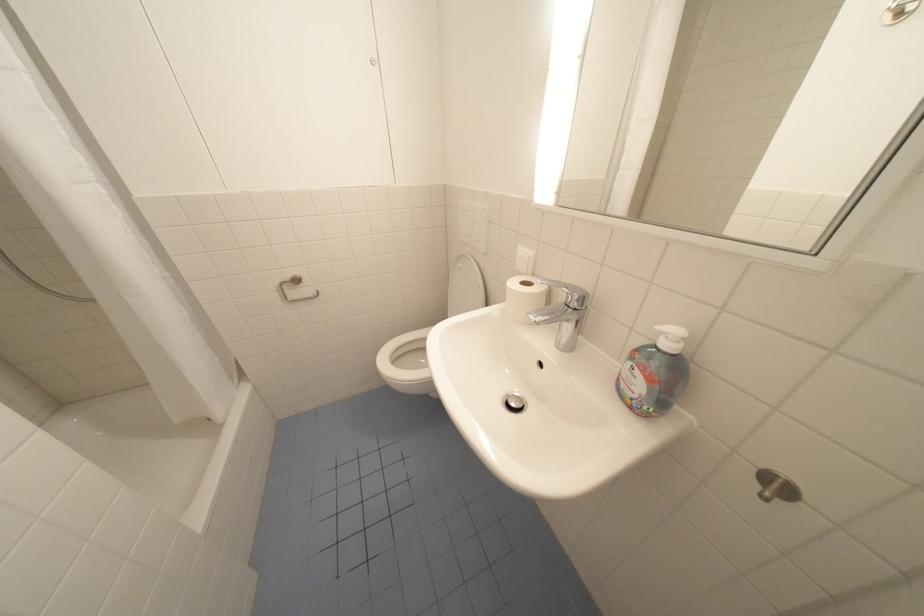
The image size is (924, 616). Find the location of `toilet flush buttons`. toilet flush buttons is located at coordinates (472, 225).